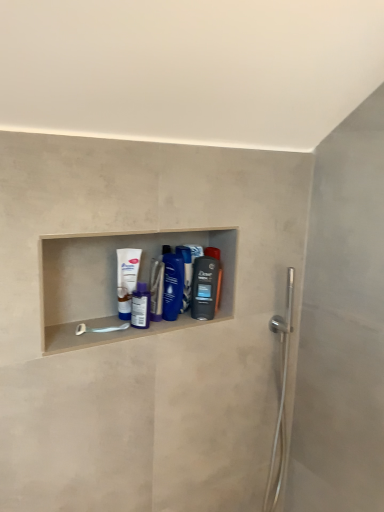
Question: From the image's perspective, is blue glossy bottle at center, acting as the second mouthwash starting from the right, above or below white glossy tube at center, the first mouthwash in the left-to-right sequence?

Choices:
 (A) above
 (B) below

Answer: (B)

Question: Do you think blue glossy bottle at center, placed as the fourth mouthwash when sorted from left to right, is within white glossy tube at center, the first mouthwash in the left-to-right sequence, or outside of it?

Choices:
 (A) inside
 (B) outside

Answer: (B)

Question: Estimate the real-world distances between objects in this image. Which object is farther from the purple glossy mouthwash at center, marked as the 2th mouthwash in a left-to-right arrangement?

Choices:
 (A) white plastic towel bar at lower left
 (B) white glossy tube at center, acting as the fifth mouthwash starting from the right
 (C) blue glossy shampoo bottle at center
 (D) blue glossy bottle at center, positioned as the 3th mouthwash in right-to-left order
 (E) blue glossy bottle at center, acting as the second mouthwash starting from the right

Answer: (C)

Question: Which object is the closest to the blue glossy shampoo bottle at center?

Choices:
 (A) translucent plastic mouthwash at center, the 1th mouthwash viewed from the right
 (B) purple glossy mouthwash at center, marked as the 2th mouthwash in a left-to-right arrangement
 (C) blue glossy bottle at center, positioned as the 3th mouthwash in right-to-left order
 (D) white plastic towel bar at lower left
 (E) blue glossy bottle at center, placed as the fourth mouthwash when sorted from left to right

Answer: (E)